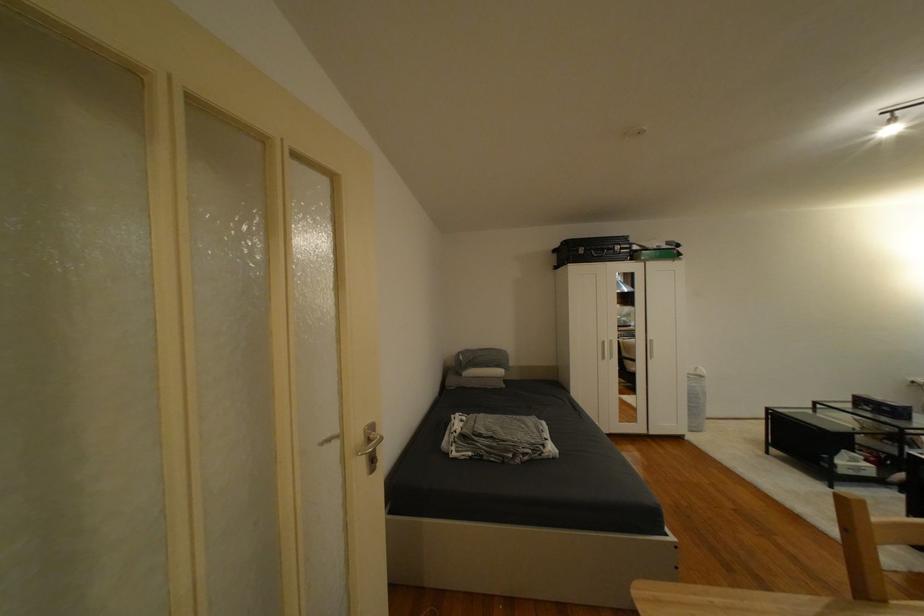
Find where to lift the purple box. Please return your answer as a coordinate pair (x, y).

(881, 407)